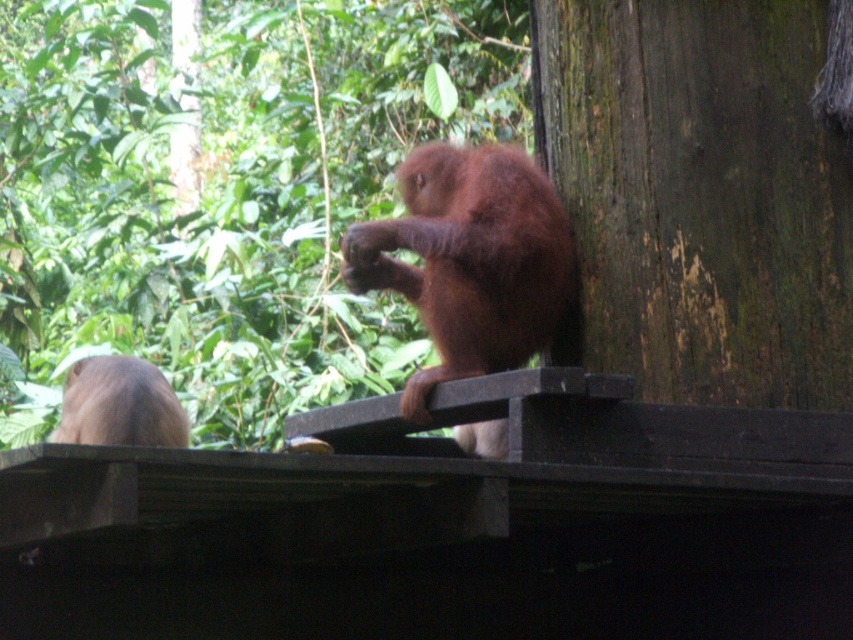
You are a wildlife researcher observing two brown monkeys in a forest enclosure. You need to place a food dispenser between them so both can reach it easily. Given their current positions, can you determine if the dispenser can be placed exactly halfway between the brown furry monkey at center and the brown fur monkey at left?

The brown furry monkey at center and the brown fur monkey at left are 29.35 inches apart. Placing the food dispenser exactly halfway would require it to be placed at 14.675 inches from each monkey, which is feasible as long as there is enough space between them. Therefore, yes, the dispenser can be placed exactly halfway between them.

You are a visitor at a wildlife sanctuary and see the dark brown wood at right and the brown furry monkey at center. Which object is taller?

The dark brown wood at right is much taller than the brown furry monkey at center.

Based on the photo, what is located at the coordinates point (469, 260) in the image?

The point (469, 260) indicates a brown furry monkey at center.